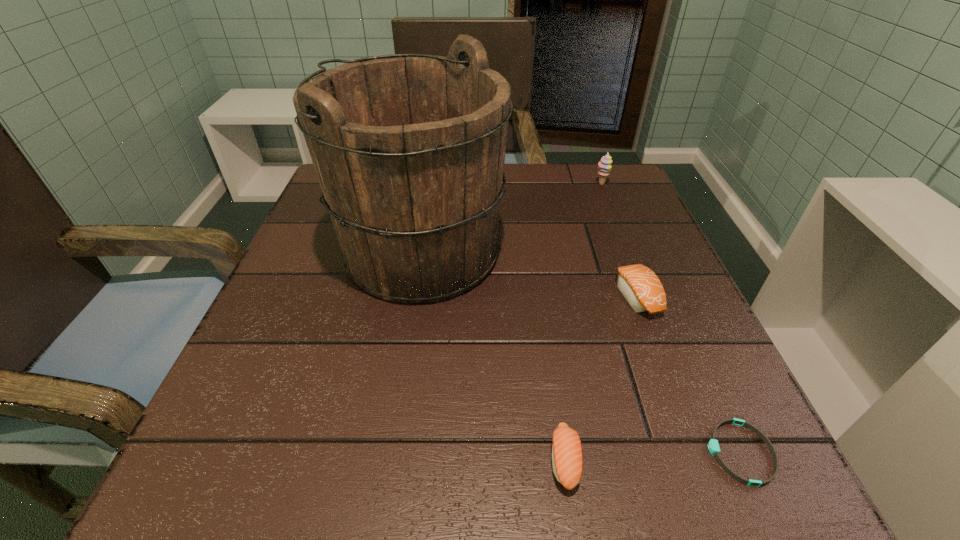
Find the location of a particular element. The width and height of the screenshot is (960, 540). unoccupied position between the farther sushi and the shortest object is located at coordinates (688, 374).

You are a GUI agent. You are given a task and a screenshot of the screen. Output one action in this format:
    pyautogui.click(x=<x>, y=<y>)
    Task: Click on the free area in between the bucket and the wristband
    The height and width of the screenshot is (540, 960).
    Given the screenshot: What is the action you would take?
    pyautogui.click(x=581, y=353)

Where is `vacant space that's between the farther sushi and the farthest object`? vacant space that's between the farther sushi and the farthest object is located at coordinates (618, 240).

Where is `empty location between the shortest object and the farthest object`? The height and width of the screenshot is (540, 960). empty location between the shortest object and the farthest object is located at coordinates (671, 319).

Find the location of a particular element. The width and height of the screenshot is (960, 540). unoccupied position between the wristband and the right sushi is located at coordinates click(688, 374).

Identify the location of vacant space that is in between the second tallest object and the left sushi. (583, 322).

Identify the location of free space that is in between the left sushi and the second tallest object. The height and width of the screenshot is (540, 960). (583, 322).

Where is `vacant region between the sherbert and the wristband`? vacant region between the sherbert and the wristband is located at coordinates (671, 319).

The image size is (960, 540). I want to click on vacant region between the bucket and the second object from left to right, so click(493, 356).

This screenshot has width=960, height=540. Identify the location of free space between the bucket and the fourth shortest object. (512, 218).